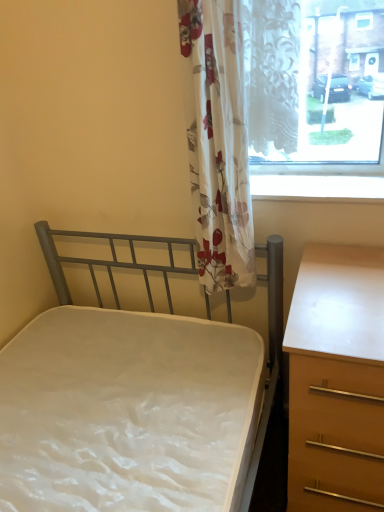
Question: Is metallic gray bed at center-left placed right next to white glossy window sill at upper center?

Choices:
 (A) yes
 (B) no

Answer: (B)

Question: Is metallic gray bed at center-left further to the viewer compared to white glossy window sill at upper center?

Choices:
 (A) yes
 (B) no

Answer: (B)

Question: Is there a large distance between metallic gray bed at center-left and white glossy window sill at upper center?

Choices:
 (A) yes
 (B) no

Answer: (B)

Question: From the image's perspective, is metallic gray bed at center-left beneath white glossy window sill at upper center?

Choices:
 (A) yes
 (B) no

Answer: (A)

Question: Would you say metallic gray bed at center-left contains white glossy window sill at upper center?

Choices:
 (A) yes
 (B) no

Answer: (B)

Question: From a real-world perspective, is floral fabric curtain at center above or below white glossy window sill at upper center?

Choices:
 (A) below
 (B) above

Answer: (B)

Question: Is floral fabric curtain at center bigger or smaller than white glossy window sill at upper center?

Choices:
 (A) big
 (B) small

Answer: (A)

Question: Is floral fabric curtain at center situated inside white glossy window sill at upper center or outside?

Choices:
 (A) inside
 (B) outside

Answer: (B)

Question: Is point (296, 122) positioned closer to the camera than point (319, 190)?

Choices:
 (A) closer
 (B) farther

Answer: (A)

Question: In terms of size, does metallic gray bed at center-left appear bigger or smaller than white glossy window sill at upper center?

Choices:
 (A) big
 (B) small

Answer: (A)

Question: Is metallic gray bed at center-left to the left or to the right of white glossy window sill at upper center in the image?

Choices:
 (A) left
 (B) right

Answer: (A)

Question: From the image's perspective, is metallic gray bed at center-left located above or below white glossy window sill at upper center?

Choices:
 (A) above
 (B) below

Answer: (B)

Question: Which is correct: metallic gray bed at center-left is inside white glossy window sill at upper center, or outside of it?

Choices:
 (A) outside
 (B) inside

Answer: (A)

Question: In terms of size, does metallic gray bed at center-left appear bigger or smaller than floral fabric curtain at center?

Choices:
 (A) big
 (B) small

Answer: (A)

Question: From a real-world perspective, is metallic gray bed at center-left above or below floral fabric curtain at center?

Choices:
 (A) above
 (B) below

Answer: (B)